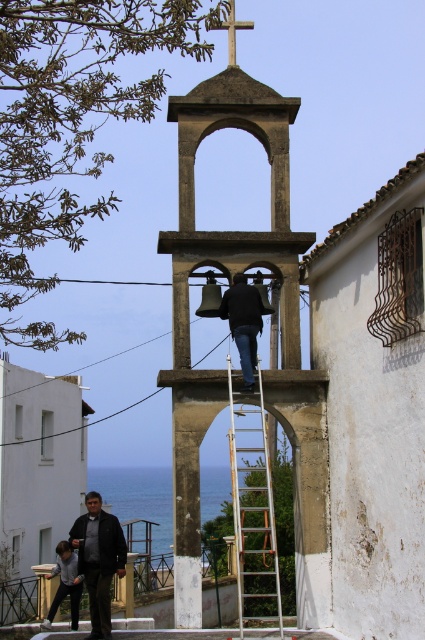
Question: Which of the following is the closest to the observer?

Choices:
 (A) white matte building at lower left
 (B) dark gray pants at lower left
 (C) dark blue jeans at center
 (D) dark gray jacket at lower left

Answer: (D)

Question: Considering the relative positions of dark gray pants at lower left and wooden cross at upper center in the image provided, where is dark gray pants at lower left located with respect to wooden cross at upper center?

Choices:
 (A) right
 (B) left

Answer: (B)

Question: Does white matte building at lower left appear on the left side of dark blue jeans at center?

Choices:
 (A) yes
 (B) no

Answer: (A)

Question: Which object is farther from the camera taking this photo?

Choices:
 (A) white matte building at lower left
 (B) wooden cross at upper center

Answer: (A)

Question: Among these points, which one is nearest to the camera?

Choices:
 (A) (78, 561)
 (B) (238, 346)
 (C) (65, 461)
 (D) (68, 580)

Answer: (B)

Question: From the image, what is the correct spatial relationship of dark gray stone bell tower at center in relation to white metallic ladder at center?

Choices:
 (A) below
 (B) above

Answer: (B)